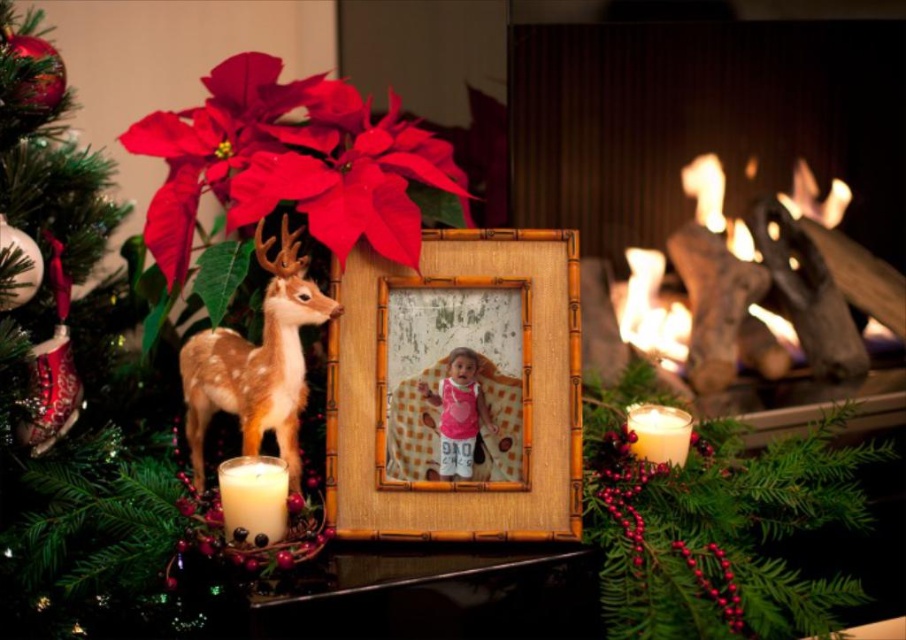
Who is positioned more to the left, translucent glass candle at lower right or white matte candle at lower left?

From the viewer's perspective, white matte candle at lower left appears more on the left side.

Is translucent glass candle at lower right to the right of white matte candle at lower left from the viewer's perspective?

Yes, translucent glass candle at lower right is to the right of white matte candle at lower left.

You are a GUI agent. You are given a task and a screenshot of the screen. Output one action in this format:
    pyautogui.click(x=<x>, y=<y>)
    Task: Click on the translucent glass candle at lower right
    This screenshot has height=640, width=906.
    Given the screenshot: What is the action you would take?
    coord(719,525)

Can you confirm if translucent glass candle at lower right is thinner than pink fabric at center?

Incorrect, translucent glass candle at lower right's width is not less than pink fabric at center's.

Who is more forward, (x=588, y=424) or (x=439, y=385)?

Point (x=439, y=385) is in front.

Locate an element on the screen. This screenshot has height=640, width=906. translucent glass candle at lower right is located at coordinates (719, 525).

Is point (362, 228) farther from viewer compared to point (242, 532)?

Yes, it is.

Who is more distant from viewer, (268, 113) or (278, 532)?

Positioned behind is point (268, 113).

Identify the location of bright red matte poinsettia at upper center. This screenshot has height=640, width=906. (290, 163).

Where is `bright red matte poinsettia at upper center`? bright red matte poinsettia at upper center is located at coordinates (290, 163).